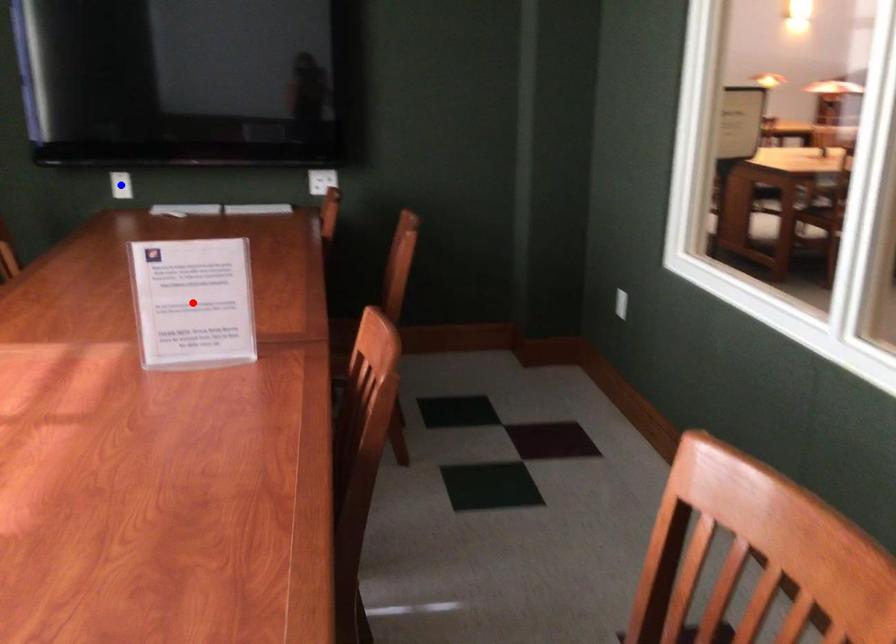
Question: In the image, two points are highlighted. Which point is nearer to the camera? Reply with the corresponding letter.

Choices:
 (A) blue point
 (B) red point

Answer: (B)